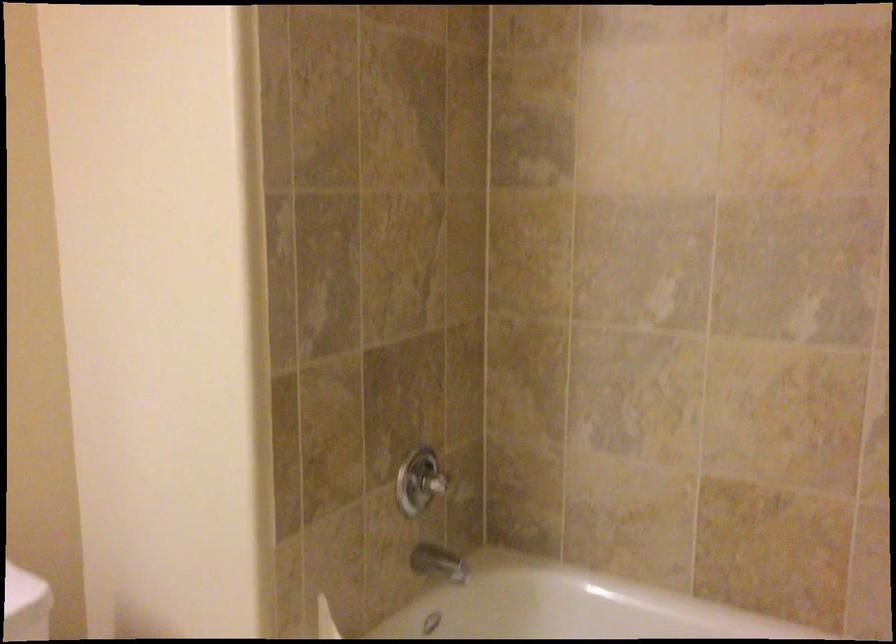
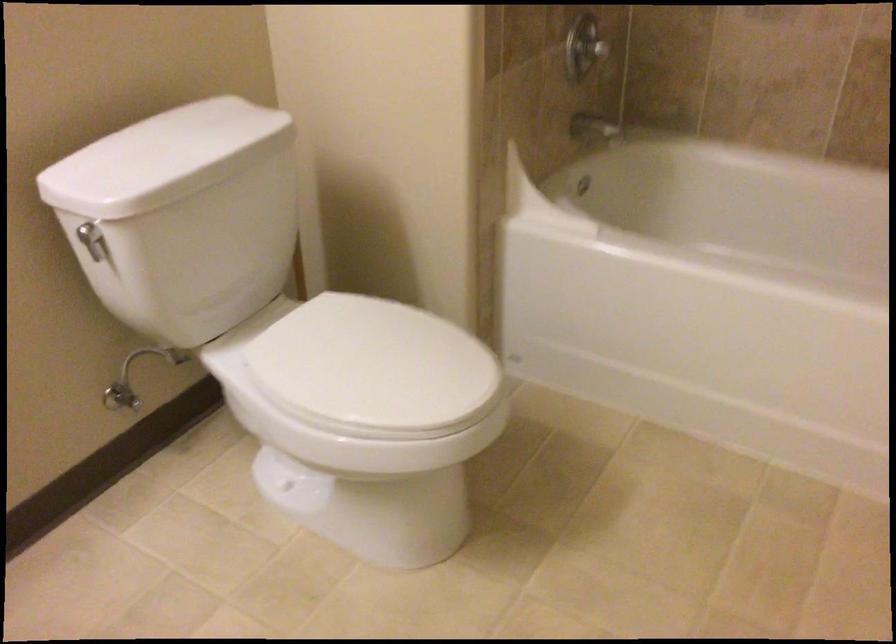
Which direction would the cameraman need to move to produce the second image?

The movement direction of the cameraman is left, backward.